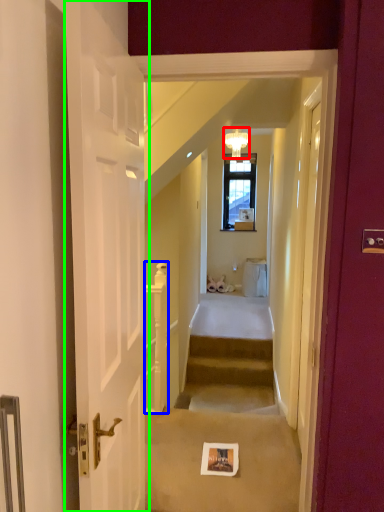
Question: Which is nearer to the light fixture (highlighted by a red box)? balustrade (highlighted by a blue box) or door (highlighted by a green box).

Choices:
 (A) balustrade
 (B) door

Answer: (A)